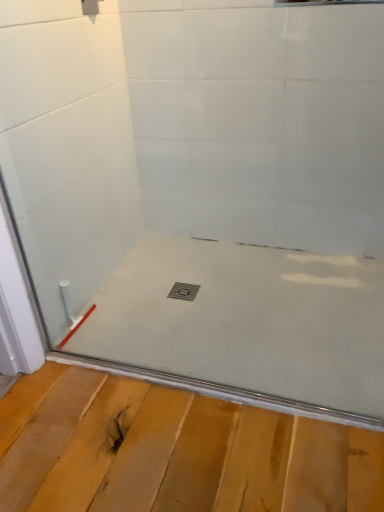
Question: Should I look upward or downward to see metallic square drain at center?

Choices:
 (A) down
 (B) up

Answer: (A)